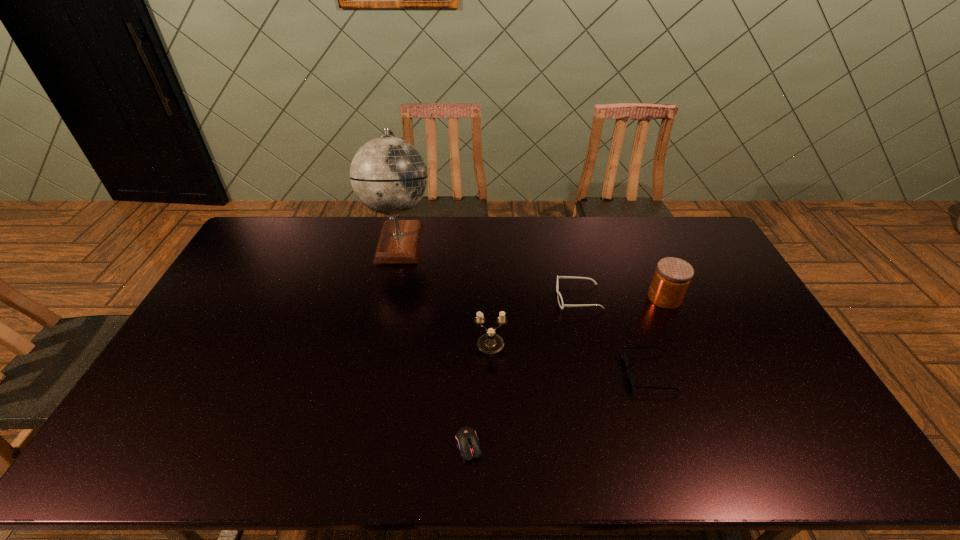
At what (x,y) coordinates should I click in order to perform the action: click on vacant region located 0.340m on the front of the jar. Please return your answer as a coordinate pair (x, y). The image size is (960, 540). Looking at the image, I should click on (710, 402).

Find the location of `vacant area situated 0.230m on the right of the candle holder`. vacant area situated 0.230m on the right of the candle holder is located at coordinates (584, 345).

I want to click on vacant area situated with the lenses of the farther sunglasses facing outward, so click(x=462, y=298).

At what (x,y) coordinates should I click in order to perform the action: click on vacant region located with the lenses of the farther sunglasses facing outward. Please return your answer as a coordinate pair (x, y). Looking at the image, I should click on (490, 298).

Locate an element on the screen. vacant space located with the lenses of the farther sunglasses facing outward is located at coordinates (471, 298).

At what (x,y) coordinates should I click in order to perform the action: click on vacant space situated 0.110m on the front-facing side of the nearer sunglasses. Please return your answer as a coordinate pair (x, y). Looking at the image, I should click on (588, 373).

Image resolution: width=960 pixels, height=540 pixels. What are the coordinates of `vacant space located on the front-facing side of the nearer sunglasses` in the screenshot? It's located at (595, 373).

At what (x,y) coordinates should I click in order to perform the action: click on vacant area situated on the front-facing side of the nearer sunglasses. Please return your answer as a coordinate pair (x, y). Looking at the image, I should click on (520, 373).

Locate an element on the screen. vacant space located on the left of the computer mouse is located at coordinates (341, 446).

I want to click on object at the far edge, so click(388, 175).